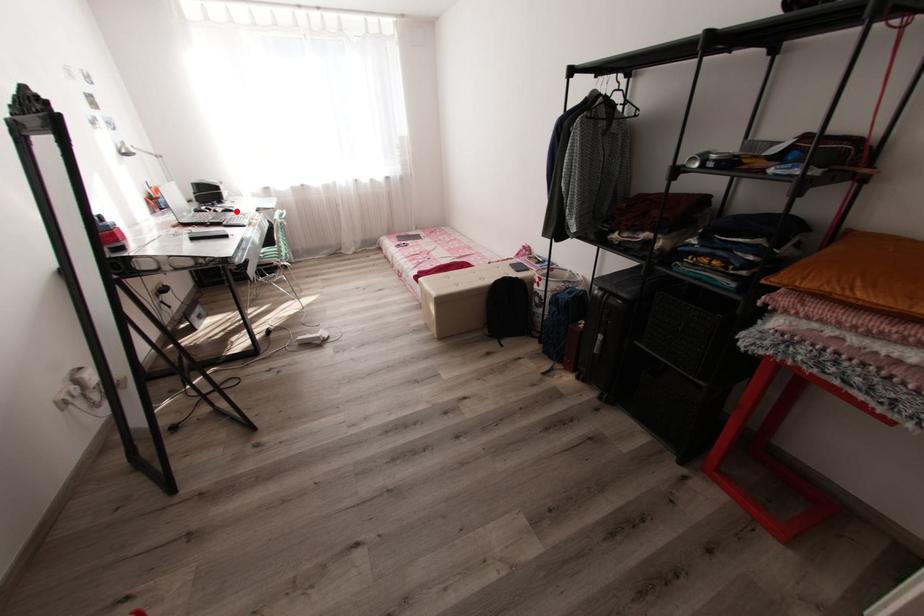
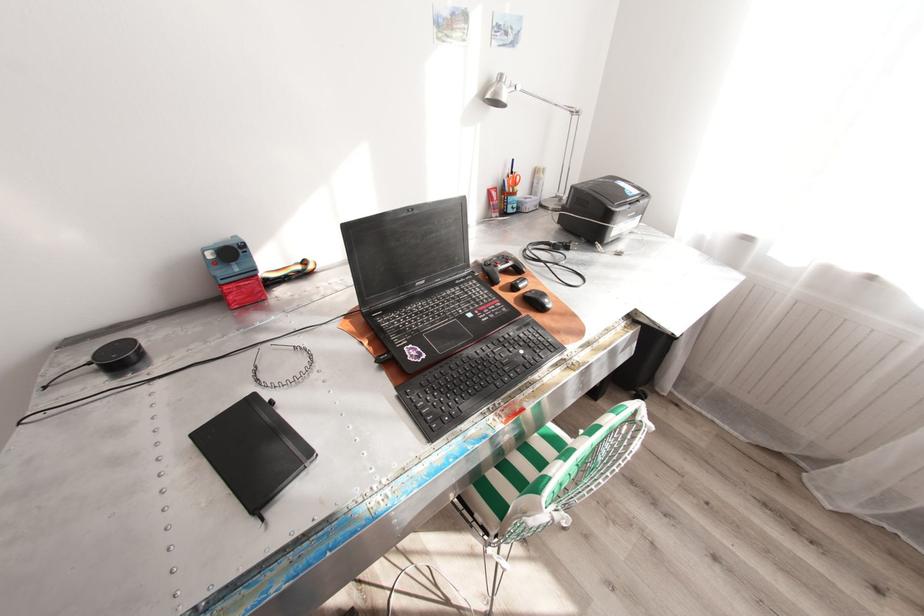
Question: I am providing you with two images of the same scene from different viewpoints. A red point is shown in image1. For the corresponding object point in image2, is it positioned nearer or farther from the camera?

Choices:
 (A) Nearer
 (B) Farther

Answer: (B)